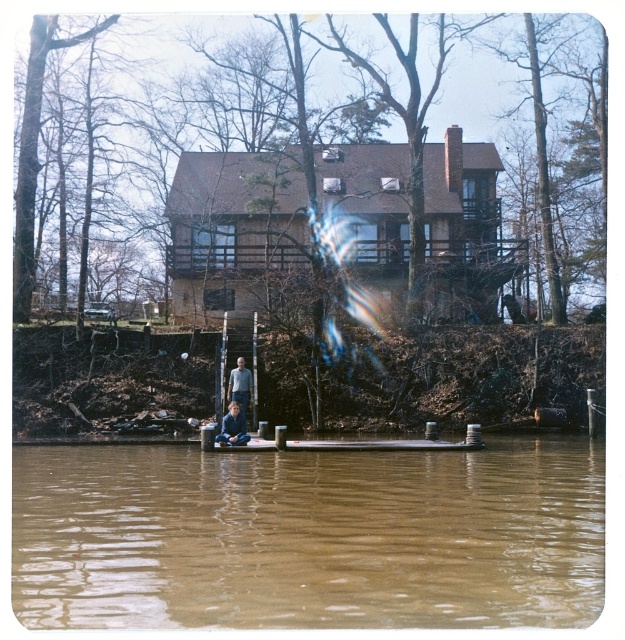
You are standing on the dock and want to place a small potted plant exactly at the point marked as point (232, 426). What object will the potted plant be placed on?

The potted plant will be placed on the dark blue sweater at center because the point (232, 426) is located on it.

You are standing on the dock and see the brown muddy water at lower center and the light blue jeans at lower center. Which object is wider from your perspective?

The brown muddy water at lower center might be wider than light blue jeans at lower center according to the description.

You are a visitor at the lakeside house and notice the brown muddy water at lower center and the dark blue sweater at center. Which object is located below the other?

The brown muddy water at lower center is positioned under the dark blue sweater at center, meaning the sweater is above the water.